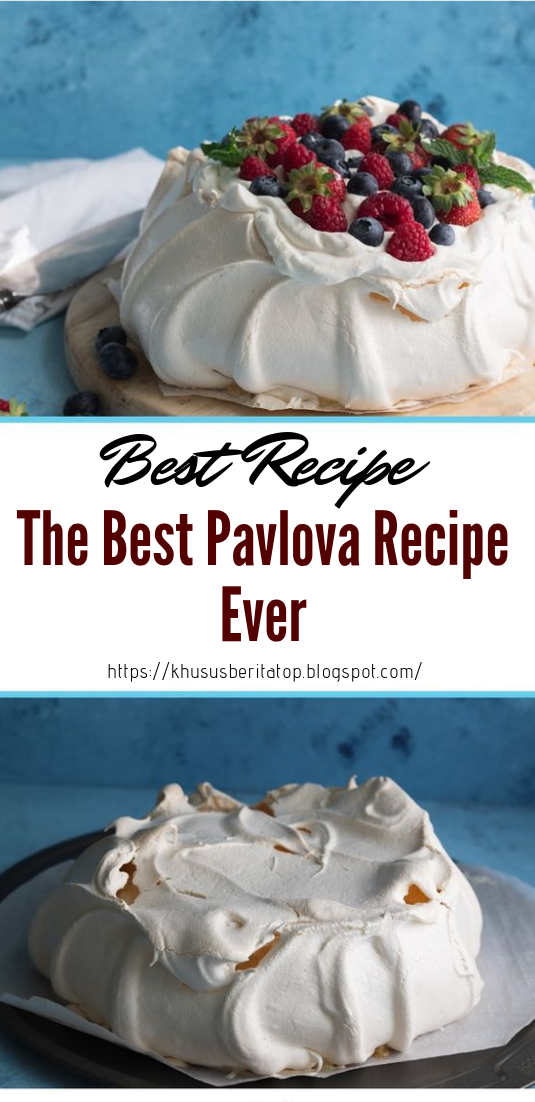
Find the location of a particular element. The image size is (535, 1102). cutting board is located at coordinates point(152,399).